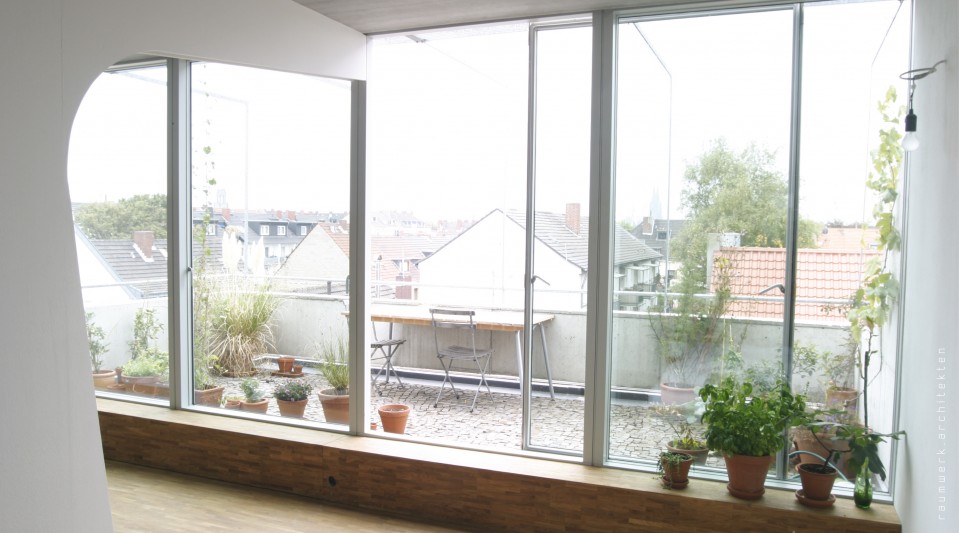
Locate an element on the screen. Image resolution: width=959 pixels, height=533 pixels. pot is located at coordinates tap(747, 471), tap(824, 489), tap(677, 477), tap(414, 415), tap(344, 413), tap(292, 395), tap(250, 406), tap(213, 395), tap(160, 387).